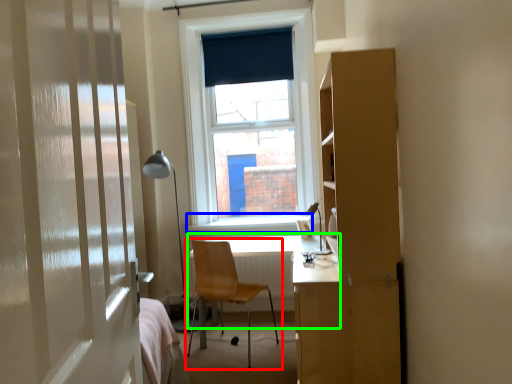
Question: Which object is the farthest from chair (highlighted by a red box)? Choose among these: window sill (highlighted by a blue box) or table (highlighted by a green box).

Choices:
 (A) window sill
 (B) table

Answer: (B)